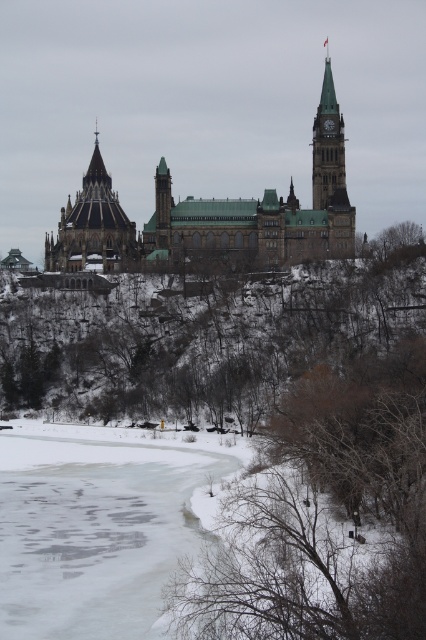
Based on the photo, you are standing in front of the grand building and want to take a photo that includes both the frozen ice at lower left and the green stone clock tower at upper center. Which object should appear larger in the photo?

The frozen ice at lower left should appear larger in the photo because it is closer to the viewer than the green stone clock tower at upper center.

You are an architect analyzing the building layout. Which of the two towers, the dark brown stone tower at upper left or the green stone clock tower at upper center, occupies more space in the image?

The dark brown stone tower at upper left has a larger size compared to the green stone clock tower at upper center, so it occupies more space in the image.

You are an architect analyzing the building layout. Which of the two towers, the dark brown stone tower at upper left or the green stone clock tower at upper center, has a greater width?

The dark brown stone tower at upper left has a greater width than the green stone clock tower at upper center.